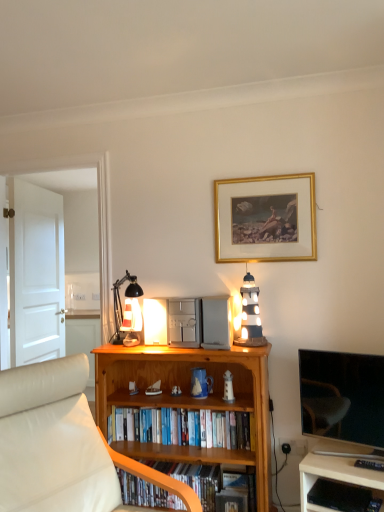
Question: From the image's perspective, is gold/gilded picture frame at upper center on top of white striped wood lighthouse at upper right?

Choices:
 (A) no
 (B) yes

Answer: (B)

Question: From the image's perspective, does gold/gilded picture frame at upper center appear lower than white striped wood lighthouse at upper right?

Choices:
 (A) yes
 (B) no

Answer: (B)

Question: Can white striped wood lighthouse at upper right be found inside gold/gilded picture frame at upper center?

Choices:
 (A) yes
 (B) no

Answer: (B)

Question: Considering the relative sizes of gold/gilded picture frame at upper center and white striped wood lighthouse at upper right in the image provided, is gold/gilded picture frame at upper center thinner than white striped wood lighthouse at upper right?

Choices:
 (A) no
 (B) yes

Answer: (B)

Question: Can you confirm if gold/gilded picture frame at upper center is positioned to the left of white striped wood lighthouse at upper right?

Choices:
 (A) no
 (B) yes

Answer: (A)

Question: Can you confirm if gold/gilded picture frame at upper center is shorter than white striped wood lighthouse at upper right?

Choices:
 (A) yes
 (B) no

Answer: (B)

Question: Can you confirm if white leather studio couch at lower left is bigger than gold/gilded picture frame at upper center?

Choices:
 (A) yes
 (B) no

Answer: (A)

Question: From the image's perspective, is white leather studio couch at lower left beneath gold/gilded picture frame at upper center?

Choices:
 (A) no
 (B) yes

Answer: (B)

Question: Considering the relative positions of white leather studio couch at lower left and gold/gilded picture frame at upper center in the image provided, is white leather studio couch at lower left to the right of gold/gilded picture frame at upper center from the viewer's perspective?

Choices:
 (A) yes
 (B) no

Answer: (B)

Question: Would you consider white leather studio couch at lower left to be distant from gold/gilded picture frame at upper center?

Choices:
 (A) yes
 (B) no

Answer: (A)

Question: Considering the relative sizes of white leather studio couch at lower left and gold/gilded picture frame at upper center in the image provided, is white leather studio couch at lower left wider than gold/gilded picture frame at upper center?

Choices:
 (A) yes
 (B) no

Answer: (A)

Question: Is white leather studio couch at lower left in contact with gold/gilded picture frame at upper center?

Choices:
 (A) yes
 (B) no

Answer: (B)

Question: Is the depth of white leather studio couch at lower left less than that of hardcover books at center, the second book from the bottom?

Choices:
 (A) no
 (B) yes

Answer: (B)